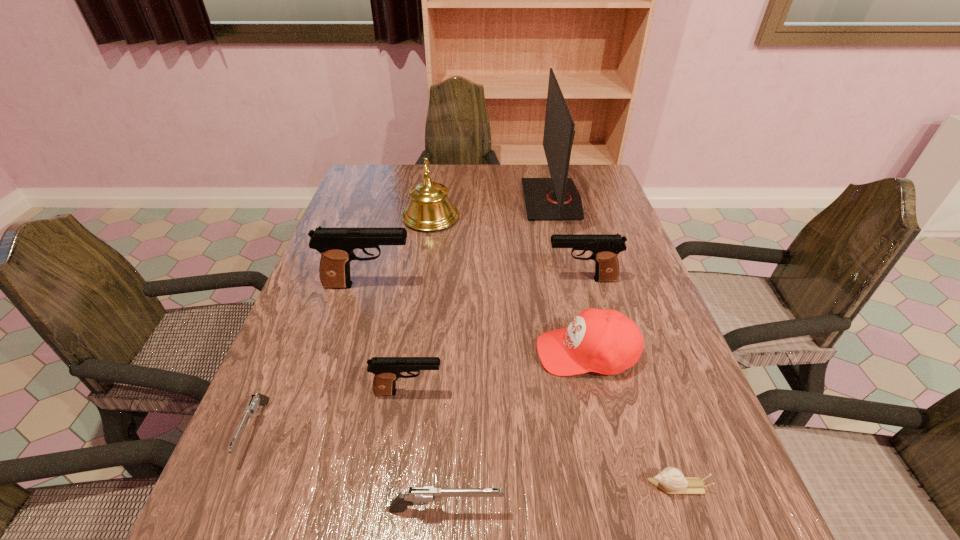
Find the location of a particular element. The width and height of the screenshot is (960, 540). free spot located on the shell of the escargot is located at coordinates (497, 486).

This screenshot has height=540, width=960. In order to click on vacant position located 0.400m on the shell of the escargot in this screenshot , I will do `click(407, 486)`.

At what (x,y) coordinates should I click in order to perform the action: click on object located at the far edge. Please return your answer as a coordinate pair (x, y). This screenshot has height=540, width=960. Looking at the image, I should click on (557, 198).

Image resolution: width=960 pixels, height=540 pixels. What are the coordinates of `monitor situated at the right edge` in the screenshot? It's located at (557, 198).

This screenshot has height=540, width=960. Find the location of `pistol located at the right edge`. pistol located at the right edge is located at coordinates (605, 247).

The image size is (960, 540). I want to click on baseball cap positioned at the right edge, so click(x=607, y=342).

Identify the location of escargot at the right edge. This screenshot has width=960, height=540. (671, 480).

Where is `object located at the far right corner`? object located at the far right corner is located at coordinates (557, 198).

Locate an element on the screen. This screenshot has width=960, height=540. vacant space at the far edge of the desktop is located at coordinates (506, 172).

Locate an element on the screen. vacant space at the left edge is located at coordinates (330, 376).